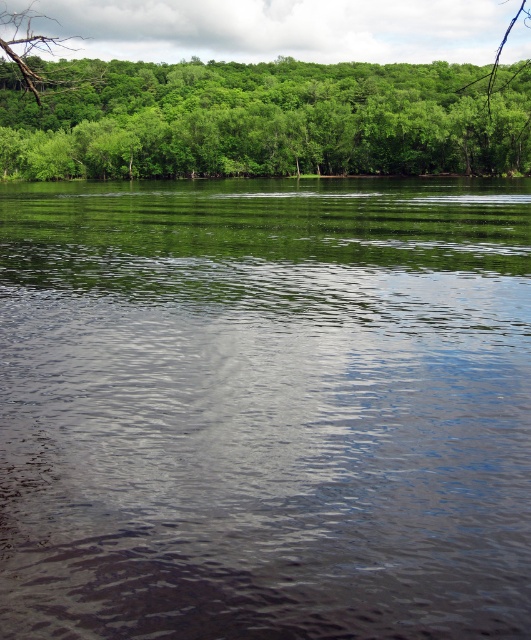
Question: Which of these objects is positioned farthest from the clear water at center?

Choices:
 (A) brown rough tree branch at upper left
 (B) green leafy tree at upper center

Answer: (B)

Question: Is green leafy tree at upper center below brown rough tree branch at upper left?

Choices:
 (A) no
 (B) yes

Answer: (A)

Question: Among these objects, which one is nearest to the camera?

Choices:
 (A) green leafy tree at upper center
 (B) clear water at center

Answer: (B)

Question: Which object appears farthest from the camera in this image?

Choices:
 (A) clear water at center
 (B) green leafy tree at upper center

Answer: (B)

Question: Is green leafy tree at upper center behind brown rough tree branch at upper left?

Choices:
 (A) yes
 (B) no

Answer: (A)

Question: Is green leafy tree at upper center to the right of brown rough tree branch at upper left from the viewer's perspective?

Choices:
 (A) no
 (B) yes

Answer: (B)